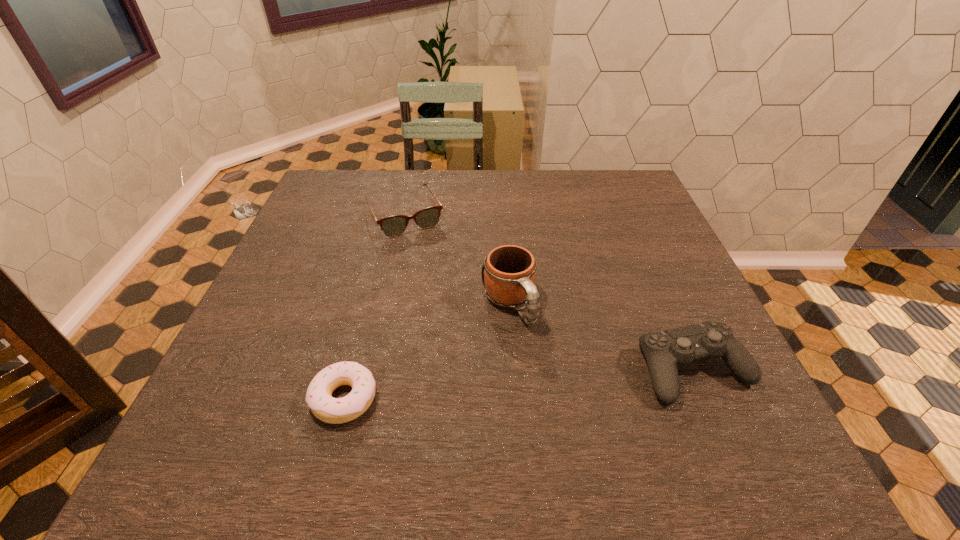
Image resolution: width=960 pixels, height=540 pixels. I want to click on vacant space that satisfies the following two spatial constraints: 1. on the front side of the farthest object; 2. on the left side of the tallest object, so click(386, 303).